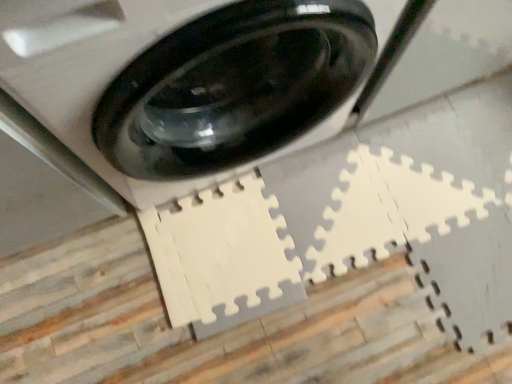
This screenshot has width=512, height=384. Describe the element at coordinates (187, 85) in the screenshot. I see `white glossy washing machine at center` at that location.

Image resolution: width=512 pixels, height=384 pixels. Identify the location of white glossy washing machine at center. (187, 85).

Find the location of a particular element. This screenshot has width=512, height=384. white glossy washing machine at center is located at coordinates (187, 85).